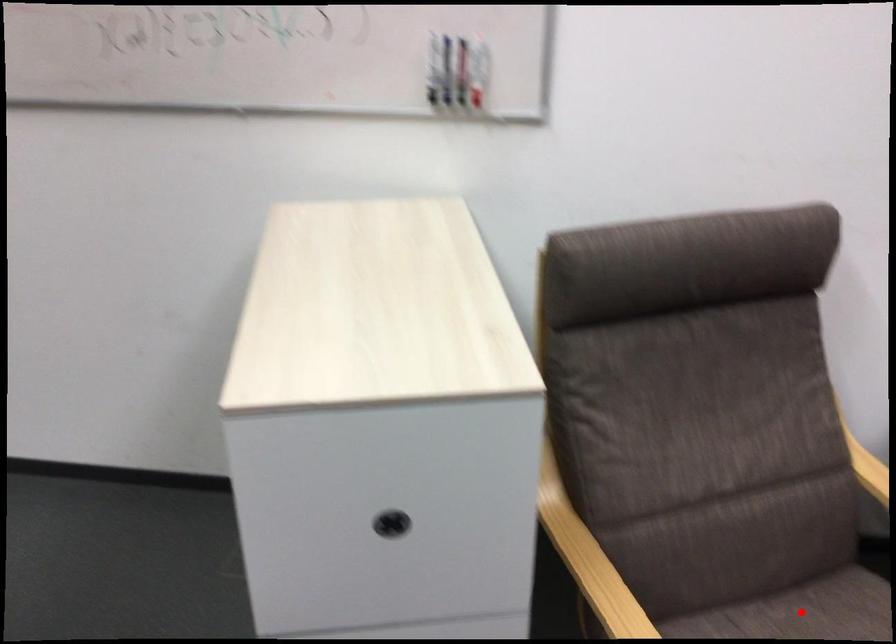
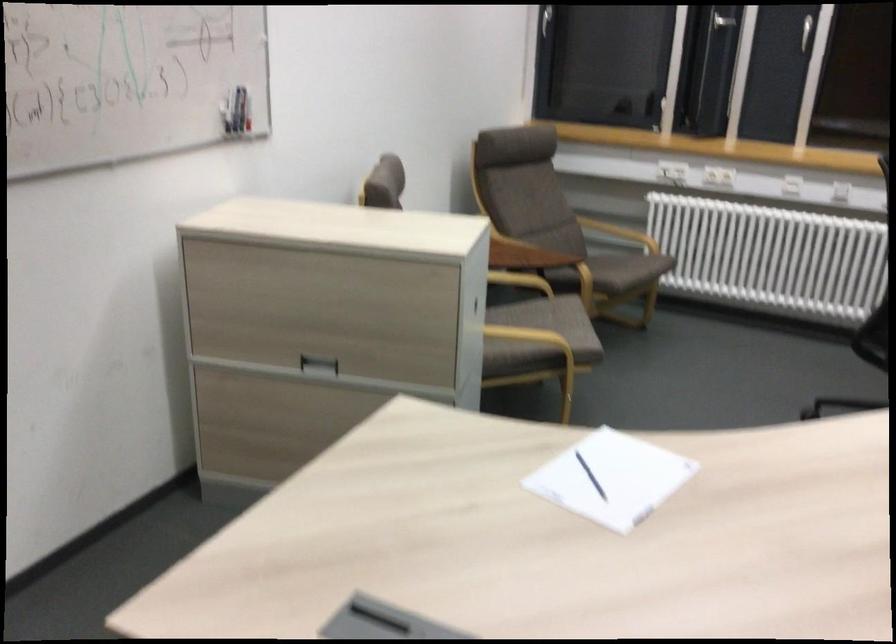
Question: I am providing you with two images of the same scene from different viewpoints. A red point is marked on the first image. Can you still see the location of the red point in image 2?

Choices:
 (A) Yes
 (B) No

Answer: (B)